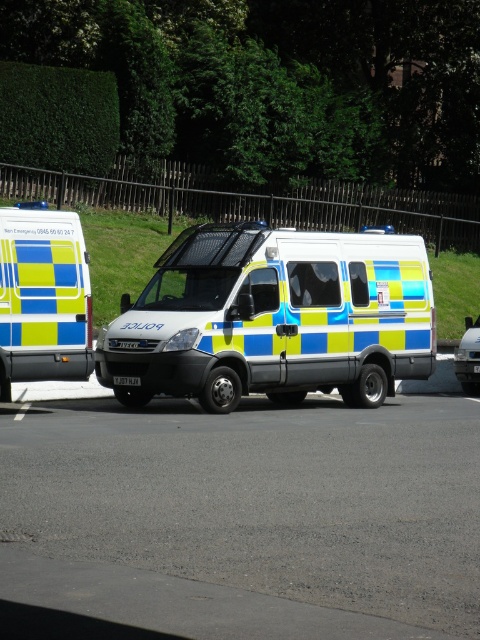
Question: Does yellow-green checkered van at center appear over metallic silver car at center?

Choices:
 (A) no
 (B) yes

Answer: (B)

Question: Estimate the real-world distances between objects in this image. Which object is closer to the yellow-green checkered van at center?

Choices:
 (A) yellow-green checkered van at left
 (B) metallic silver car at center

Answer: (A)

Question: Which of the following is the closest to the observer?

Choices:
 (A) metallic silver car at center
 (B) yellow-green checkered van at left

Answer: (B)

Question: Estimate the real-world distances between objects in this image. Which object is farther from the metallic silver car at center?

Choices:
 (A) yellow-green checkered van at left
 (B) yellow-green checkered van at center

Answer: (A)

Question: Can you confirm if yellow-green checkered van at left is positioned above metallic silver car at center?

Choices:
 (A) yes
 (B) no

Answer: (A)

Question: Does yellow-green checkered van at left have a smaller size compared to metallic silver car at center?

Choices:
 (A) yes
 (B) no

Answer: (B)